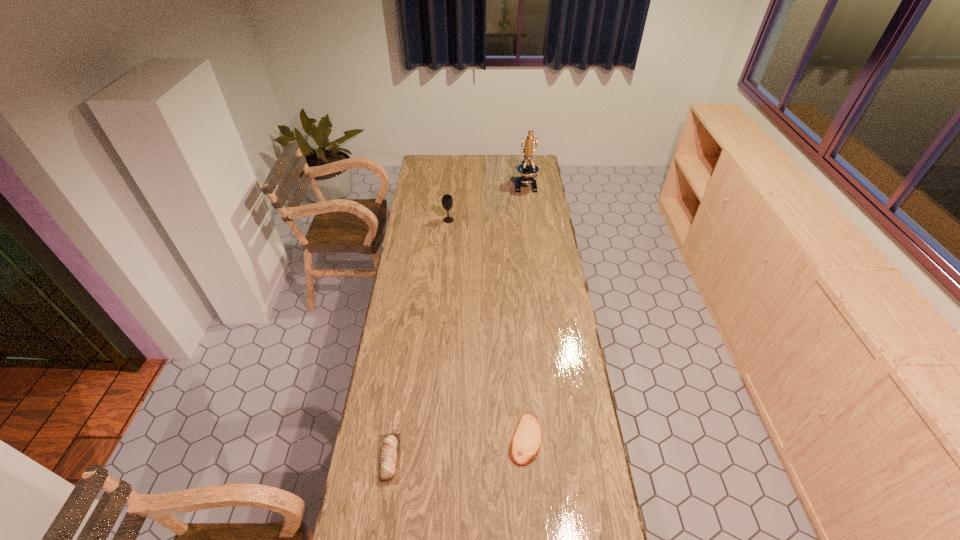
Locate an element on the screen. The image size is (960, 540). free region located on the right of the leftmost object is located at coordinates (436, 458).

At what (x,y) coordinates should I click in order to perform the action: click on free region located 0.150m on the back of the shorter pita bread. Please return your answer as a coordinate pair (x, y). The image size is (960, 540). Looking at the image, I should click on (521, 377).

The image size is (960, 540). I want to click on object at the far edge, so click(527, 169).

I want to click on object that is at the left edge, so click(389, 454).

Find the location of a particular element. This screenshot has height=540, width=960. object located at the right edge is located at coordinates (527, 169).

Image resolution: width=960 pixels, height=540 pixels. In order to click on object that is at the far right corner in this screenshot , I will do `click(527, 169)`.

Where is `free space at the far edge`? Image resolution: width=960 pixels, height=540 pixels. free space at the far edge is located at coordinates (495, 160).

In the image, there is a desktop. Find the location of `vacant space at the left edge`. vacant space at the left edge is located at coordinates (372, 438).

In order to click on free region at the right edge of the desktop in this screenshot , I will do pyautogui.click(x=559, y=288).

Where is `vacant space in between the leftmost object and the wineglass`? The width and height of the screenshot is (960, 540). vacant space in between the leftmost object and the wineglass is located at coordinates (419, 339).